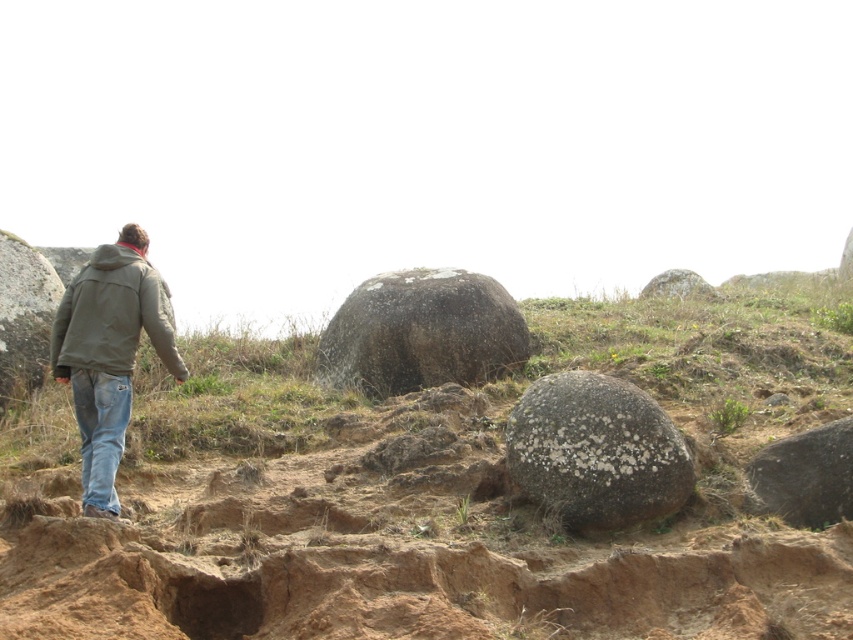
Question: Which object appears farthest from the camera in this image?

Choices:
 (A) jeans at lower left
 (B) smooth gray rock at left
 (C) rough stone boulder at center
 (D) speckled gray rock at center

Answer: (B)

Question: Which object is positioned closest to the speckled rock at center?

Choices:
 (A) rough stone boulder at center
 (B) smooth gray rock at left
 (C) speckled gray rock at lower right

Answer: (B)

Question: Can you confirm if jeans at lower left is wider than gray speckled rock at upper right?

Choices:
 (A) no
 (B) yes

Answer: (A)

Question: Which of the following is the farthest from the observer?

Choices:
 (A) (399, 371)
 (B) (549, 545)

Answer: (A)

Question: Does speckled rock at center appear under green matte jacket at left?

Choices:
 (A) yes
 (B) no

Answer: (A)

Question: Does speckled gray rock at center appear on the left side of gray speckled rock at upper right?

Choices:
 (A) no
 (B) yes

Answer: (B)